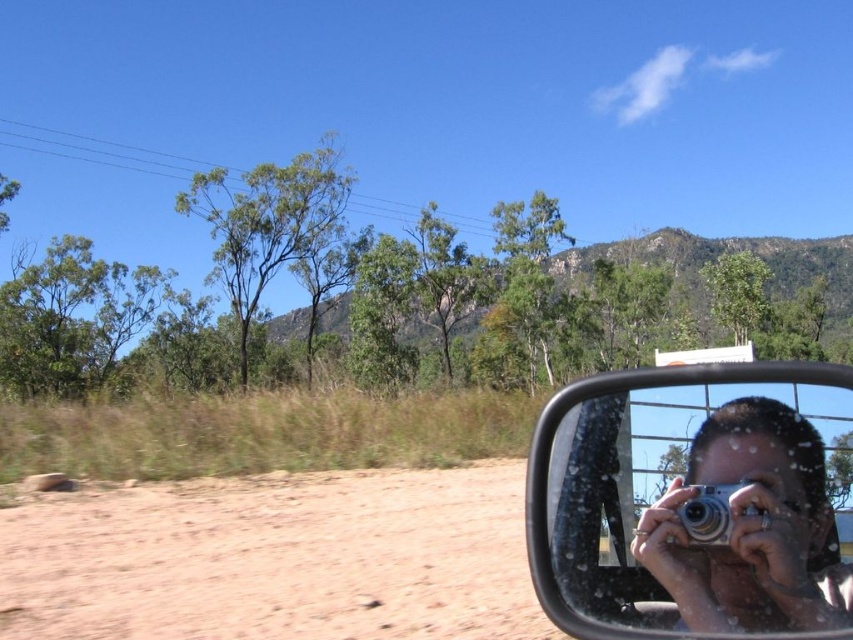
Question: Which point is farther to the camera?

Choices:
 (A) silver metallic mirror at right
 (B) brown sandy dirt track at lower left

Answer: (B)

Question: Which is nearer to the silver metallic camera at right?

Choices:
 (A) silver metallic mirror at right
 (B) brown sandy dirt track at lower left

Answer: (A)

Question: Can you confirm if brown sandy dirt track at lower left is wider than silver metallic camera at right?

Choices:
 (A) no
 (B) yes

Answer: (B)

Question: Can you confirm if brown sandy dirt track at lower left is positioned below silver metallic mirror at right?

Choices:
 (A) no
 (B) yes

Answer: (B)

Question: Considering the relative positions of silver metallic mirror at right and silver metallic camera at right in the image provided, where is silver metallic mirror at right located with respect to silver metallic camera at right?

Choices:
 (A) right
 (B) left

Answer: (B)

Question: Among these objects, which one is farthest from the camera?

Choices:
 (A) brown sandy dirt track at lower left
 (B) silver metallic mirror at right
 (C) silver metallic camera at right

Answer: (A)